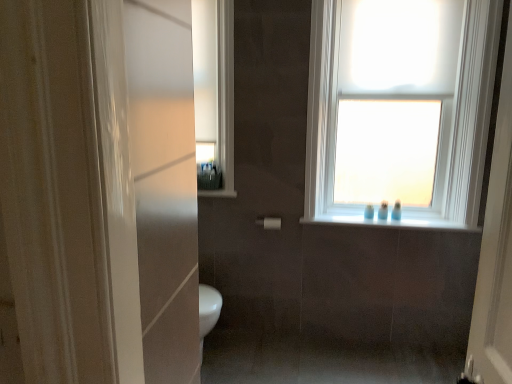
I want to click on blank area to the left of blue glossy toothbrush at upper right, the 4th toiletry positioned from the left, so click(372, 219).